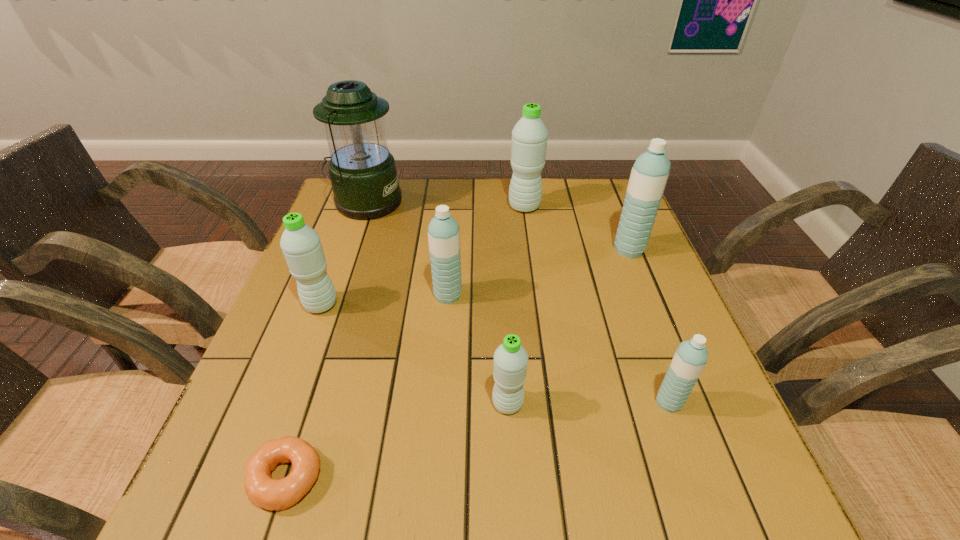
The height and width of the screenshot is (540, 960). I want to click on the fifth object from left to right, so click(x=510, y=359).

The image size is (960, 540). I want to click on the smallest blue water bottle, so click(x=690, y=358).

Identify the location of tan doughnut. (263, 491).

Where is `the nearest object`? This screenshot has height=540, width=960. the nearest object is located at coordinates (263, 491).

The height and width of the screenshot is (540, 960). Find the location of `free region located 0.150m on the front of the lantern`. free region located 0.150m on the front of the lantern is located at coordinates (348, 255).

Identify the location of vacant region located on the left of the farthest water bottle. (488, 207).

You are a GUI agent. You are given a task and a screenshot of the screen. Output one action in this format:
    pyautogui.click(x=<x>, y=<y>)
    Task: Click on the free space located on the back of the second farthest water bottle
    This screenshot has width=960, height=540.
    Given the screenshot: What is the action you would take?
    tap(604, 188)

Locate an element on the screen. free spot located 0.100m on the front of the second water bottle from left to right is located at coordinates (444, 340).

Locate an element on the screen. The width and height of the screenshot is (960, 540). vacant space located 0.190m on the right of the second nearest green water bottle is located at coordinates (421, 305).

Image resolution: width=960 pixels, height=540 pixels. Find the location of `free space located on the back of the fourth water bottle from right to left`. free space located on the back of the fourth water bottle from right to left is located at coordinates (504, 341).